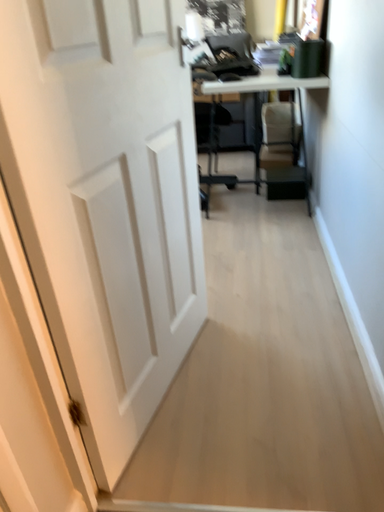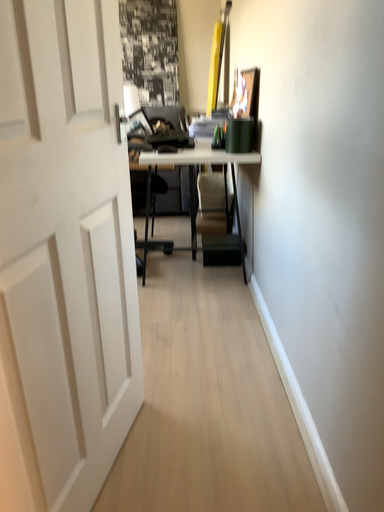
Question: Which way did the camera rotate in the video?

Choices:
 (A) rotated downward
 (B) rotated upward

Answer: (B)